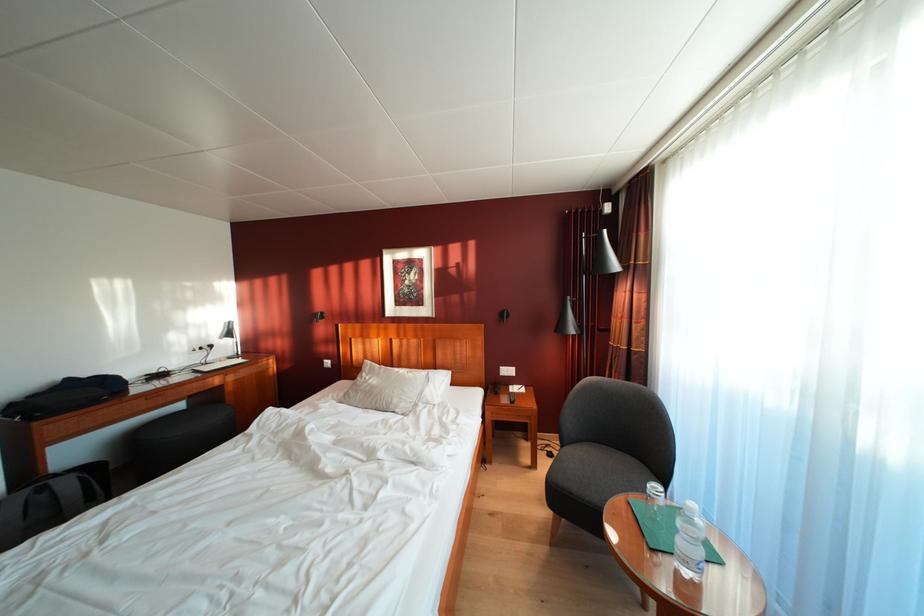
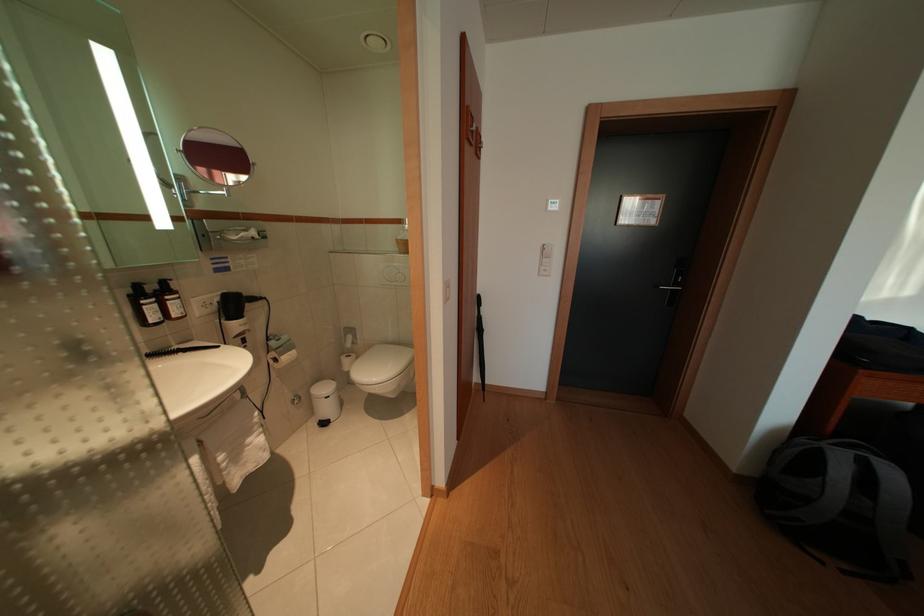
The point at (75, 488) is marked in the first image. Where is the corresponding point in the second image?

(901, 480)